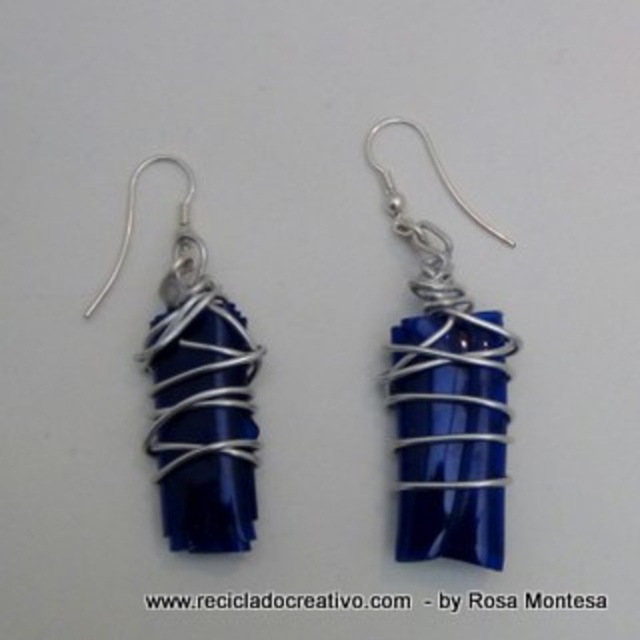
You are a jeweler examining the image of the earrings. You need to place a small sticker on the blue glass wire at right. What are the coordinates where you should place the sticker?

The coordinates for placing the sticker on the blue glass wire at right are at point (445, 396).

You are a jeweler examining the handmade earrings. You need to determine which part is easier to bend between the blue glass wire at right and the blue glossy stone at center. Which one would you choose?

The blue glass wire at right is thinner than the blue glossy stone at center, so the blue glass wire at right is easier to bend.